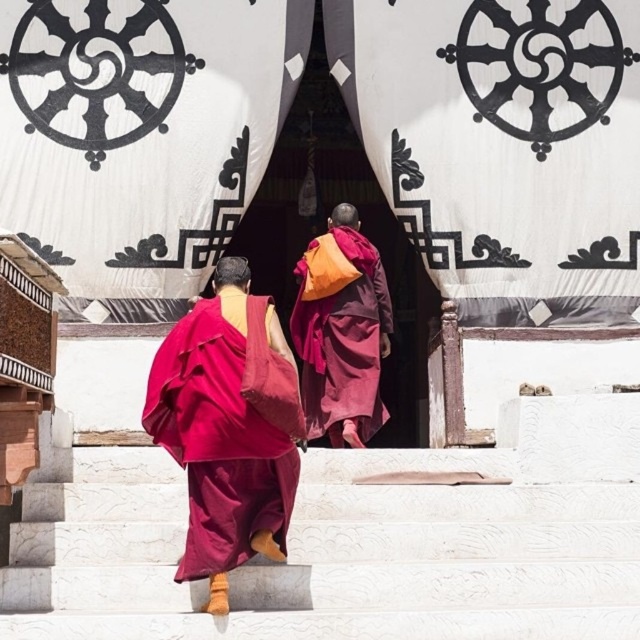
Can you confirm if maroon silk robe at center is shorter than maroon woolen robe at center?

Yes, maroon silk robe at center is shorter than maroon woolen robe at center.

Does maroon silk robe at center appear over maroon woolen robe at center?

Incorrect, maroon silk robe at center is not positioned above maroon woolen robe at center.

Is point (218, 394) positioned after point (305, 314)?

No, it is in front of (305, 314).

This screenshot has width=640, height=640. Find the location of `maroon silk robe at center`. maroon silk robe at center is located at coordinates (220, 436).

What do you see at coordinates (356, 541) in the screenshot? I see `white marble stairs at center` at bounding box center [356, 541].

Can you confirm if white marble stairs at center is positioned to the right of maroon woolen robe at center?

Correct, you'll find white marble stairs at center to the right of maroon woolen robe at center.

Describe the element at coordinates (356, 541) in the screenshot. The height and width of the screenshot is (640, 640). I see `white marble stairs at center` at that location.

Find the location of a particular element. white marble stairs at center is located at coordinates (356, 541).

Which is more to the left, white marble stairs at center or maroon silk robe at center?

From the viewer's perspective, maroon silk robe at center appears more on the left side.

I want to click on white marble stairs at center, so click(356, 541).